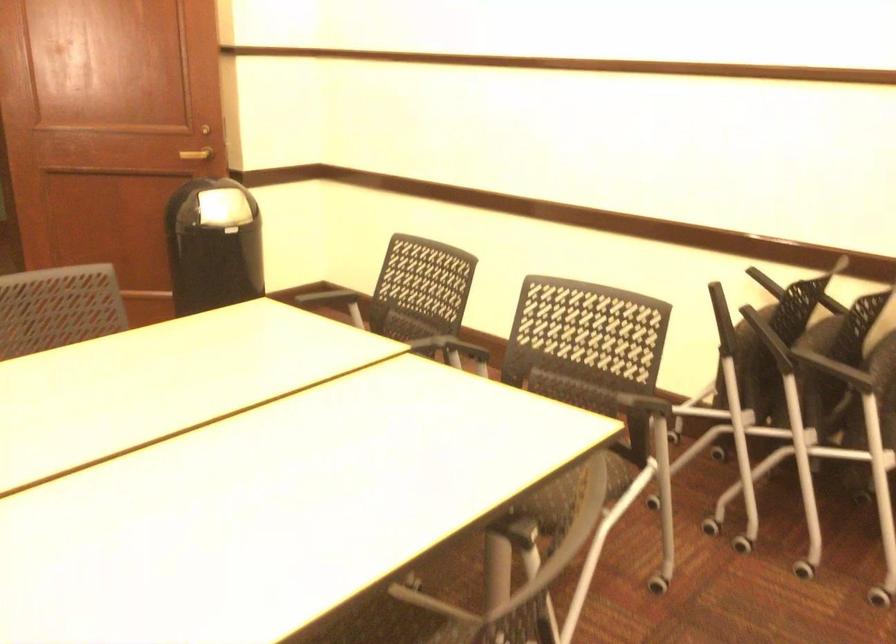
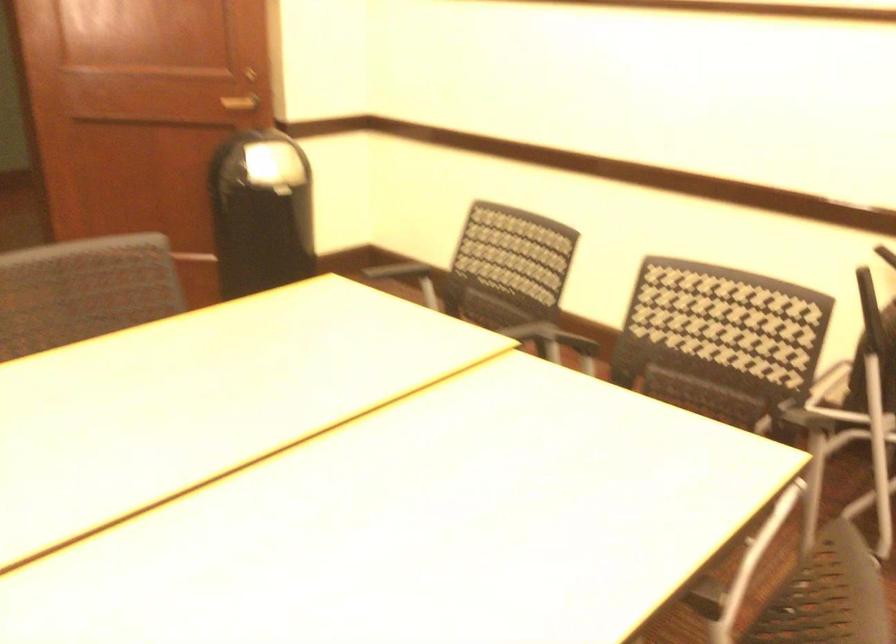
Where in the second image is the point corresponding to (183,151) from the first image?

(240, 102)